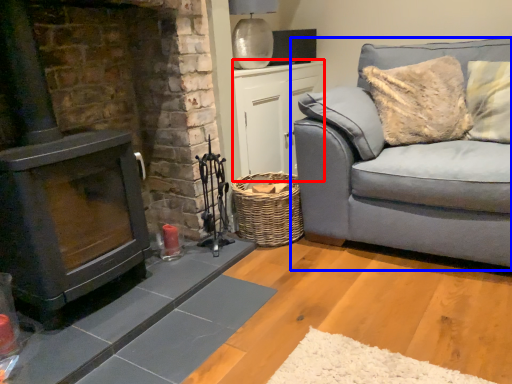
Question: Which point is further to the camera, table (highlighted by a red box) or studio couch (highlighted by a blue box)?

Choices:
 (A) table
 (B) studio couch

Answer: (A)